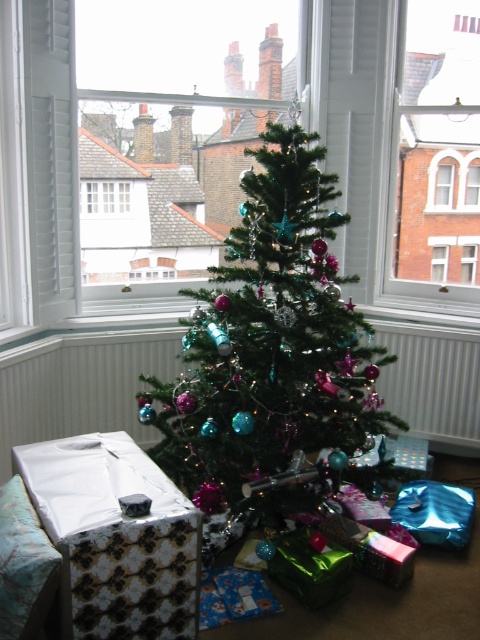
Question: Is green shiny christmas tree at center behind green matte christmas tree at center?

Choices:
 (A) yes
 (B) no

Answer: (B)

Question: Which point is closer to the camera taking this photo?

Choices:
 (A) (471, 269)
 (B) (130, 154)
 (C) (92, 182)

Answer: (C)

Question: Does green shiny christmas tree at center have a lesser width compared to green matte christmas tree at center?

Choices:
 (A) no
 (B) yes

Answer: (A)

Question: Which object is the closest to the clear glass window at center?

Choices:
 (A) green matte christmas tree at center
 (B) white wooden window at upper left
 (C) green shiny christmas tree at center
 (D) transparent glass window at center

Answer: (D)

Question: Is green shiny christmas tree at center to the left of transparent glass window at center from the viewer's perspective?

Choices:
 (A) yes
 (B) no

Answer: (A)

Question: Estimate the real-world distances between objects in this image. Which object is closer to the green shiny christmas tree at center?

Choices:
 (A) white wooden window at upper left
 (B) transparent glass window at center

Answer: (A)